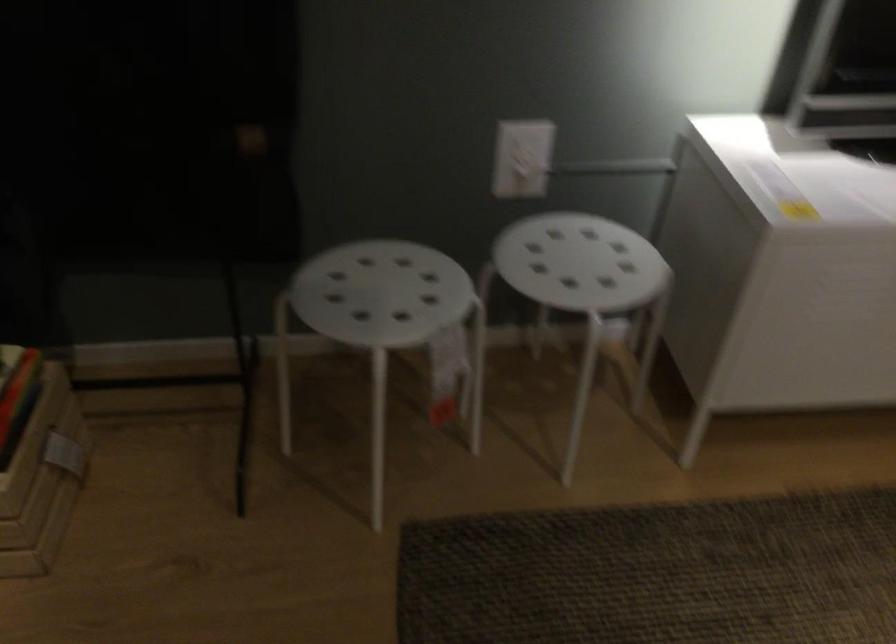
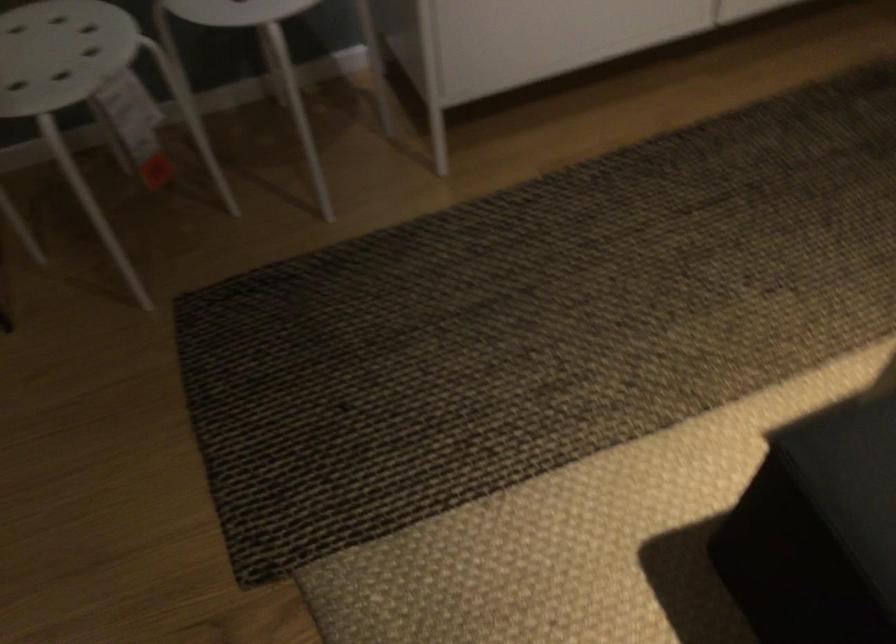
Find the pixel in the second image that matches (560,287) in the first image.

(235, 11)